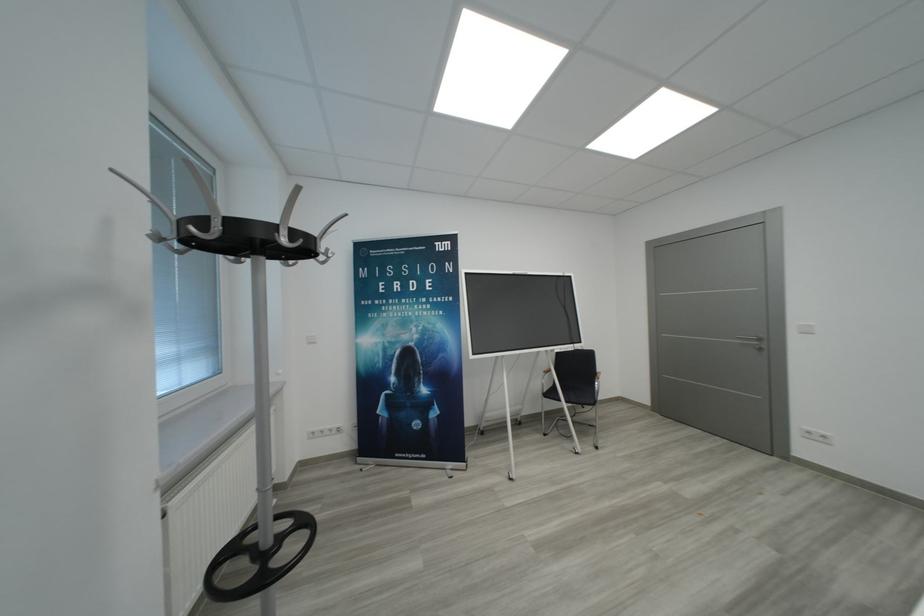
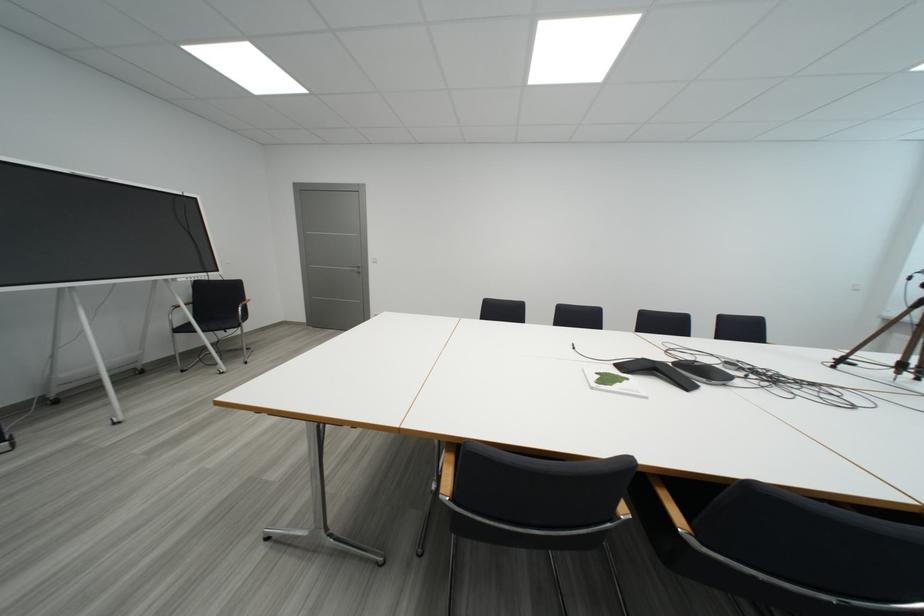
Locate, in the second image, the point that corresponds to [767,342] in the first image.

(366, 270)